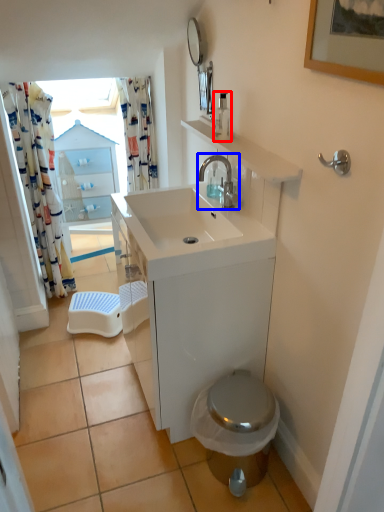
Question: Among these objects, which one is farthest to the camera, soap dispenser (highlighted by a red box) or tap (highlighted by a blue box)?

Choices:
 (A) soap dispenser
 (B) tap

Answer: (A)